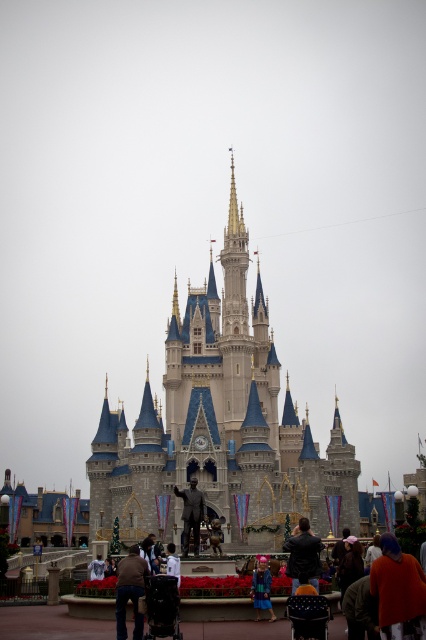
Question: Can you confirm if light gray stone castle at center is positioned to the right of dark brown leather jacket at center?

Choices:
 (A) no
 (B) yes

Answer: (A)

Question: Which object is the farthest from the polished bronze statue at center?

Choices:
 (A) bronze statue at center
 (B) brown leather jacket at lower left
 (C) light gray stone castle at center

Answer: (C)

Question: Is orange fabric jacket at lower right behind bronze statue at center?

Choices:
 (A) yes
 (B) no

Answer: (B)

Question: Considering the relative positions of orange fabric jacket at lower right and brown leather jacket at lower left in the image provided, where is orange fabric jacket at lower right located with respect to brown leather jacket at lower left?

Choices:
 (A) right
 (B) left

Answer: (A)

Question: Which of the following is the closest to the observer?

Choices:
 (A) white shirt at center
 (B) light gray stone castle at center
 (C) light brown leather jacket at center

Answer: (A)

Question: Estimate the real-world distances between objects in this image. Which object is farther from the blue velvet coat at lower center?

Choices:
 (A) light brown leather jacket at center
 (B) white shirt at center

Answer: (A)